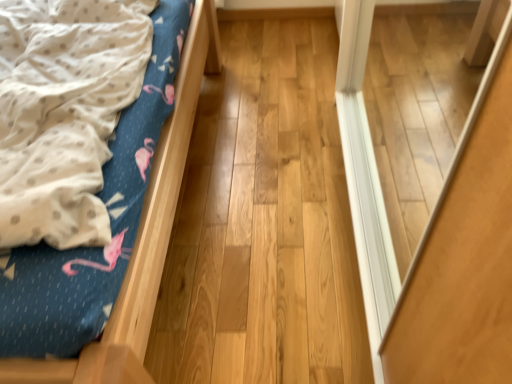
Locate an element on the screen. The width and height of the screenshot is (512, 384). blue cotton bed at left is located at coordinates (141, 236).

What do you see at coordinates (141, 236) in the screenshot? I see `blue cotton bed at left` at bounding box center [141, 236].

The width and height of the screenshot is (512, 384). Find the location of `blue cotton bed at left`. blue cotton bed at left is located at coordinates (141, 236).